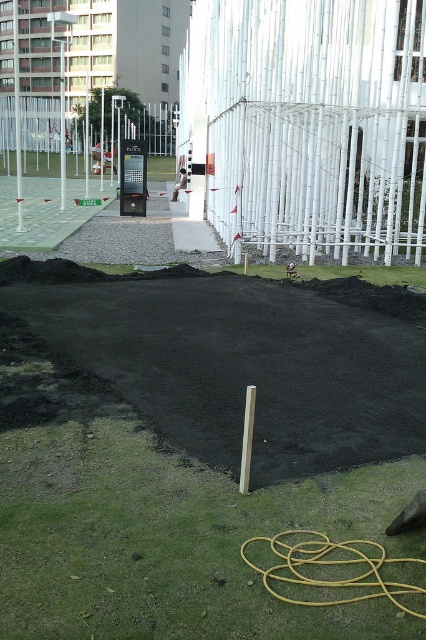
You are a delivery person trying to navigate through the construction site. You see the white bamboo fence at upper center and the white metal fence at upper center. Which fence is closer to you?

The white bamboo fence at upper center and white metal fence at upper center are 41.78 meters apart from each other, so you need to determine which one is closer based on their positions. However, the description only provides the distance between them, not their individual distances from your current position. Without additional information, it is impossible to determine which is closer.

You are a construction worker who needs to place a new sign on the left side of the white bamboo fence at upper center and the white metal fence at upper center. Which fence should you place the sign on the left side of?

The white metal fence at upper center is to the left of the white bamboo fence at upper center, so you should place the sign on the left side of the white metal fence at upper center.